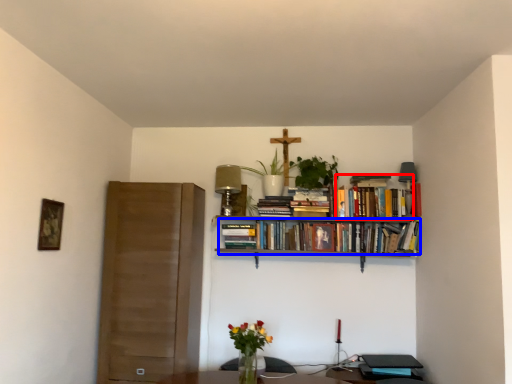
Question: Which point is closer to the camera, book (highlighted by a red box) or book (highlighted by a blue box)?

Choices:
 (A) book
 (B) book

Answer: (B)